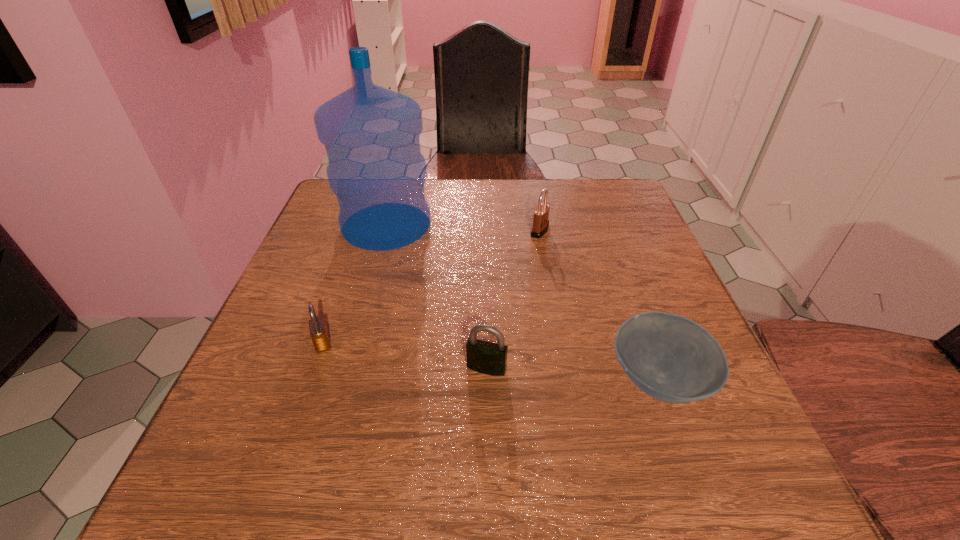
This screenshot has height=540, width=960. Identify the location of vacant space located on the left of the second padlock from right to left. (408, 368).

Where is `free space located 0.110m on the back of the leftmost padlock`? This screenshot has width=960, height=540. free space located 0.110m on the back of the leftmost padlock is located at coordinates (340, 293).

Locate an element on the screen. free location located on the left of the rightmost object is located at coordinates (535, 380).

At what (x,y) coordinates should I click in order to perform the action: click on water jug that is at the far edge. Please return your answer as a coordinate pair (x, y). The image size is (960, 540). Looking at the image, I should click on (371, 134).

Where is `padlock positioned at the far edge`? padlock positioned at the far edge is located at coordinates (541, 214).

The image size is (960, 540). I want to click on water jug that is at the left edge, so click(371, 134).

Locate an element on the screen. This screenshot has height=540, width=960. padlock present at the left edge is located at coordinates (318, 331).

At what (x,y) coordinates should I click in order to perform the action: click on object located in the right edge section of the desktop. Please return your answer as a coordinate pair (x, y). The image size is (960, 540). Looking at the image, I should click on (669, 357).

I want to click on object located in the far left corner section of the desktop, so click(371, 134).

This screenshot has height=540, width=960. Identify the location of free space at the far edge of the desktop. (505, 183).